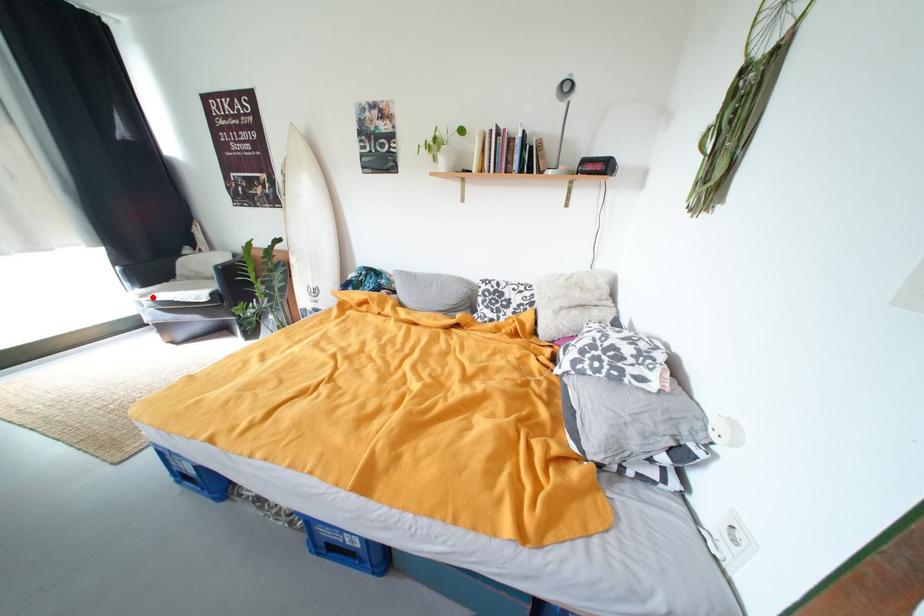
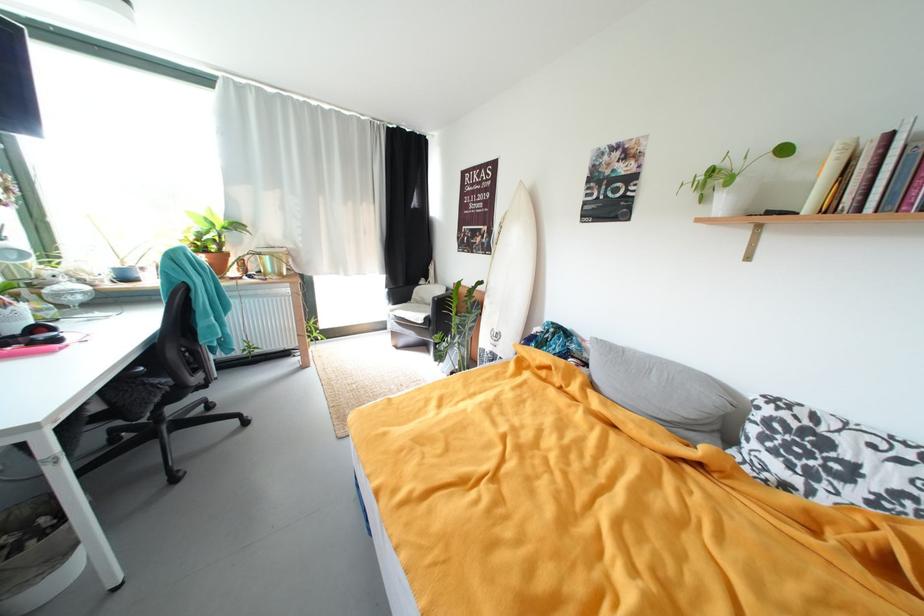
Locate, in the second image, the point that corresponds to the highlighted location in the first image.

(399, 313)